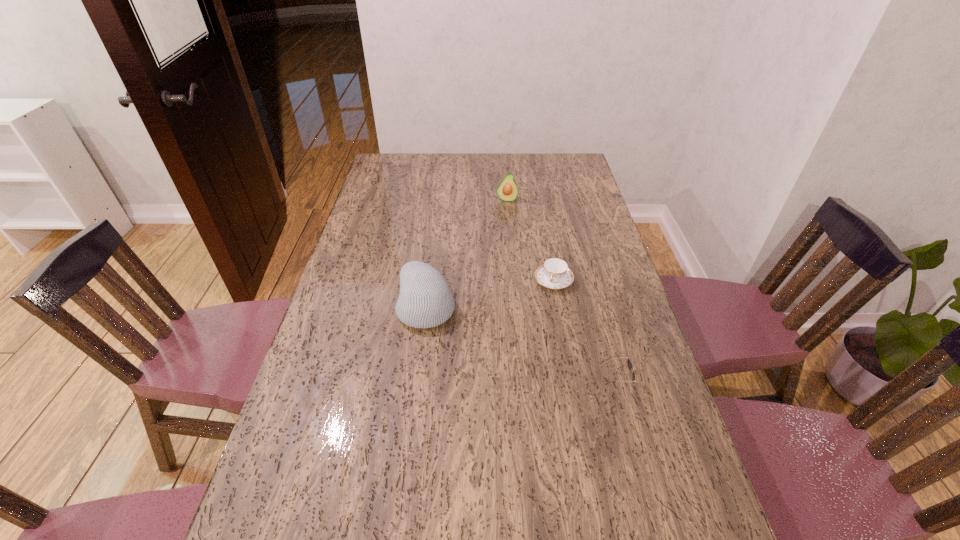
This screenshot has width=960, height=540. Find the location of `vacant space that's between the leftmost object and the shortest object`. vacant space that's between the leftmost object and the shortest object is located at coordinates pyautogui.click(x=490, y=293).

You are a GUI agent. You are given a task and a screenshot of the screen. Output one action in this format:
    pyautogui.click(x=<x>, y=<y>)
    Task: Click on the object that stands as the second closest to the rightmost object
    
    Given the screenshot: What is the action you would take?
    pyautogui.click(x=425, y=300)

Identify the location of object that is the third closest to the rightmost object. (507, 190).

This screenshot has width=960, height=540. I want to click on vacant space that satisfies the following two spatial constraints: 1. on the front side of the second object from left to right; 2. in front of the lenses of the nearest object, so click(x=522, y=385).

In order to click on vacant position in the image that satisfies the following two spatial constraints: 1. on the front side of the farthest object; 2. on the left side of the shortest object in this screenshot , I will do `click(514, 281)`.

Locate an element on the screen. free space that satisfies the following two spatial constraints: 1. on the back side of the third object from right to left; 2. on the right side of the leftmost object is located at coordinates (440, 200).